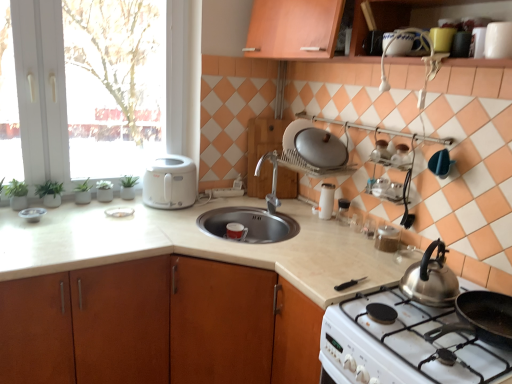
Find the location of a particular element. Image resolution: width=512 pixels, height=384 pixels. free space to the left of clear glass salt and pepper shakers at center, the 4th appliance in the right-to-left sequence is located at coordinates (313, 220).